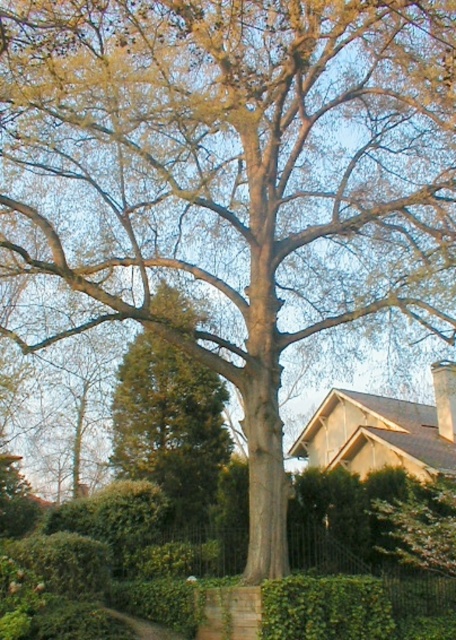
You are standing in the garden and want to take a photo of the green leafy tree at center. However, there is a green leafy hedge at lower center in the way. Can you see the tree clearly through the hedge?

The green leafy hedge at lower center is behind the green leafy tree at center, so you can see the tree clearly without obstruction from the hedge.

You are standing in the garden and want to take a photo of the green leafy tree at center and the green leafy hedge at lower center. Which object should you position to your left to frame the scene properly?

To frame the scene properly, position the green leafy tree at center to your left since it is on the left side of the green leafy hedge at lower center.